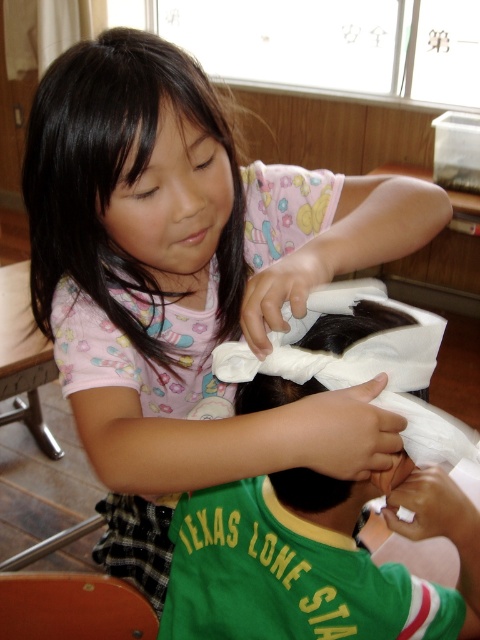
Question: Is white paper towel at center bigger than black silky hair at upper left?

Choices:
 (A) no
 (B) yes

Answer: (B)

Question: Can you confirm if white paper towel at center is smaller than black silky hair at upper left?

Choices:
 (A) yes
 (B) no

Answer: (B)

Question: Among these points, which one is farthest from the camera?

Choices:
 (A) (107, 150)
 (B) (223, 592)

Answer: (B)

Question: Among these points, which one is nearest to the camera?

Choices:
 (A) (104, 134)
 (B) (409, 509)

Answer: (A)

Question: Does white paper towel at center have a greater width compared to black silky hair at upper left?

Choices:
 (A) no
 (B) yes

Answer: (B)